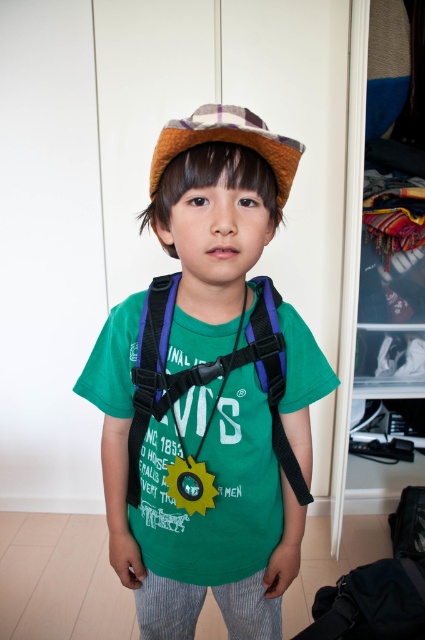
Can you confirm if purple fabric strap at center is positioned to the left of plaid fabric cowboy hat at upper center?

In fact, purple fabric strap at center is to the right of plaid fabric cowboy hat at upper center.

Is purple fabric strap at center below plaid fabric cowboy hat at upper center?

Indeed, purple fabric strap at center is positioned under plaid fabric cowboy hat at upper center.

The image size is (425, 640). What do you see at coordinates (207, 372) in the screenshot?
I see `purple fabric strap at center` at bounding box center [207, 372].

Locate an element on the screen. The height and width of the screenshot is (640, 425). purple fabric strap at center is located at coordinates (207, 372).

Which of these two, green matte t-shirt at center or plaid fabric cowboy hat at upper center, stands taller?

green matte t-shirt at center

Is point (291, 397) in front of point (184, 118)?

No, it is not.

Is point (331, 371) in front of point (299, 157)?

No, (331, 371) is behind (299, 157).

Where is `green matte t-shirt at center`? green matte t-shirt at center is located at coordinates (207, 392).

Which is more to the left, green matte t-shirt at center or purple fabric strap at center?

Positioned to the left is green matte t-shirt at center.

Is green matte t-shirt at center behind purple fabric strap at center?

No, it is in front of purple fabric strap at center.

The image size is (425, 640). Identify the location of green matte t-shirt at center. (207, 392).

Where is `green matte t-shirt at center`? The width and height of the screenshot is (425, 640). green matte t-shirt at center is located at coordinates (207, 392).